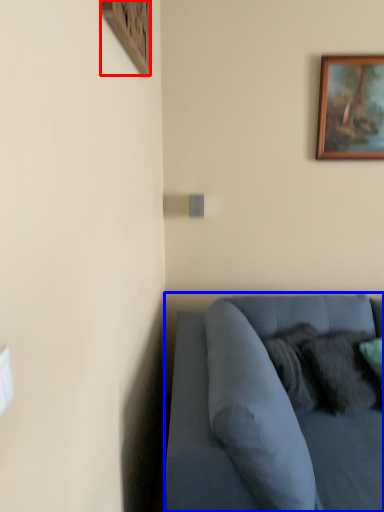
Question: Which of the following is the farthest to the observer, picture frame (highlighted by a red box) or studio couch (highlighted by a blue box)?

Choices:
 (A) picture frame
 (B) studio couch

Answer: (A)